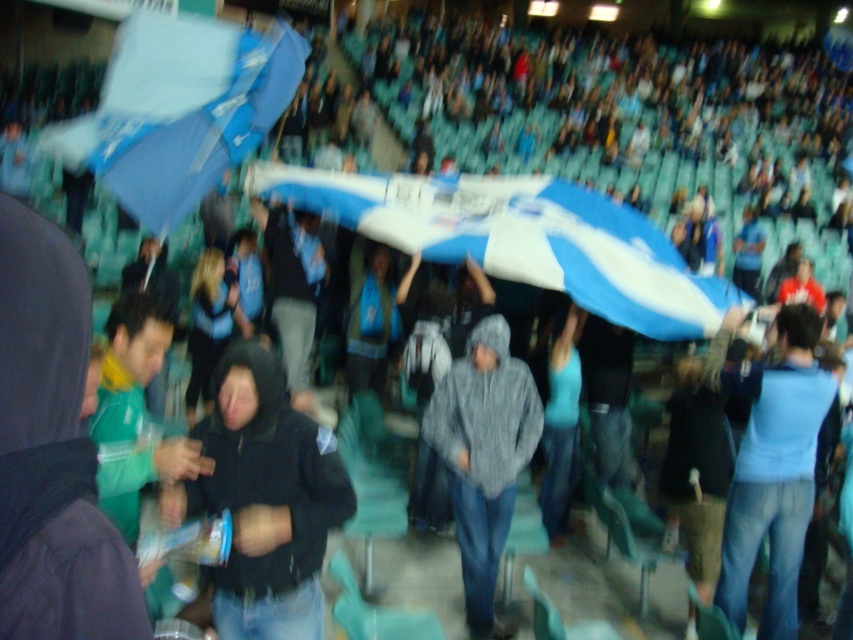
Question: Among these points, which one is farthest from the camera?

Choices:
 (A) (218, 481)
 (B) (502, 472)

Answer: (B)

Question: Does black matte hoodie at center appear on the right side of gray hoodie at center?

Choices:
 (A) yes
 (B) no

Answer: (B)

Question: Which point appears farthest from the camera in this image?

Choices:
 (A) (483, 564)
 (B) (221, 570)

Answer: (A)

Question: Is black matte hoodie at center thinner than gray hoodie at center?

Choices:
 (A) no
 (B) yes

Answer: (A)

Question: Which point appears closest to the camera in this image?

Choices:
 (A) (466, 412)
 (B) (293, 576)

Answer: (B)

Question: Does black matte hoodie at center have a smaller size compared to gray hoodie at center?

Choices:
 (A) no
 (B) yes

Answer: (B)